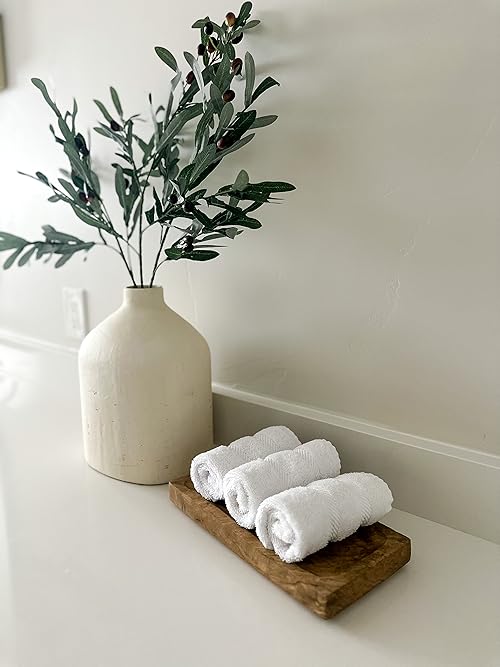
The image size is (500, 667). Identify the location of right hand towel. (274, 438).